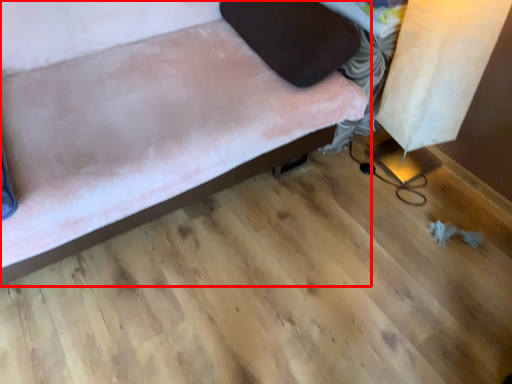
Question: From the image's perspective, where is furniture (annotated by the red box) located relative to pillow?

Choices:
 (A) below
 (B) above

Answer: (A)